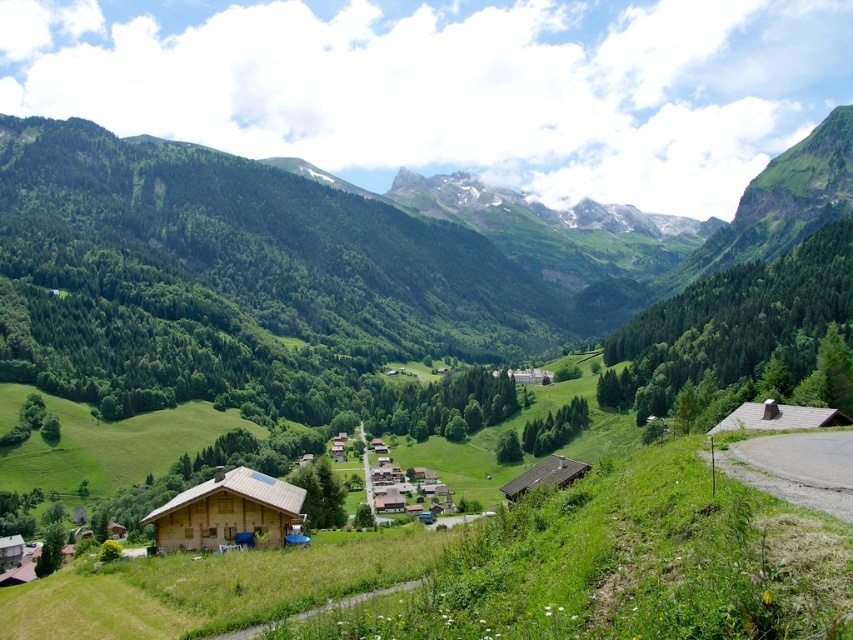
Question: Considering the real-world distances, which object is farthest from the brown wooden hut at lower right?

Choices:
 (A) wooden houses at center
 (B) wooden cabin at lower left

Answer: (A)

Question: Which object appears closest to the camera in this image?

Choices:
 (A) wooden cabin at center
 (B) wooden houses at center

Answer: (B)

Question: Does wooden cabin at lower left have a larger size compared to wooden cabin at lower right?

Choices:
 (A) yes
 (B) no

Answer: (B)

Question: From the image, what is the correct spatial relationship of wooden houses at center in relation to wooden cabin at center-right?

Choices:
 (A) left
 (B) right

Answer: (A)

Question: Estimate the real-world distances between objects in this image. Which object is closer to the wooden houses at center?

Choices:
 (A) wooden cabin at lower right
 (B) green grassy path at lower center
 (C) wooden cabin at center

Answer: (C)

Question: Is wooden cabin at lower left in front of wooden houses at center?

Choices:
 (A) no
 (B) yes

Answer: (B)